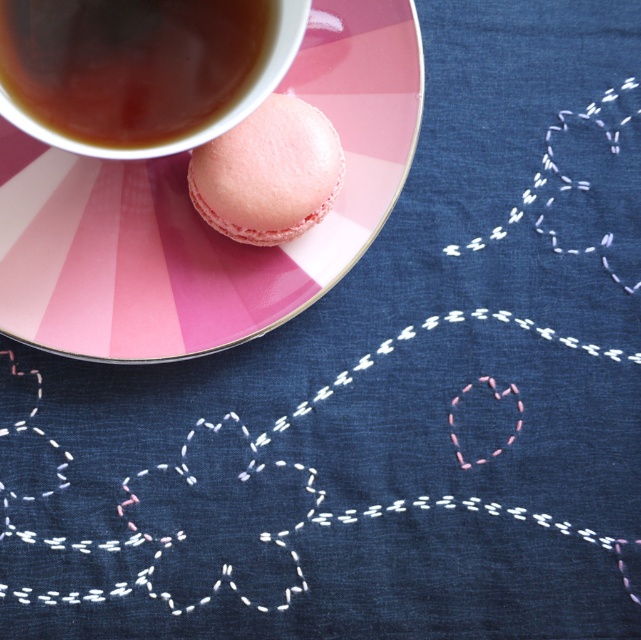
You are a food stylist arranging a tea set. You have a dark brown liquid at upper left and a pink matte macaron at center. Which item has a greater height?

The pink matte macaron at center is taller than the dark brown liquid at upper left because the dark brown liquid at upper left is shorter than pink matte macaron at center.

You are a food stylist arranging items on a table. You have a pink glossy macaron at upper left and a pink matte macaron at center. The customer wants to know if the distance between them is sufficient for a photo shoot. The minimum required distance for the camera setup is 3.5 inches. Can the current arrangement meet this requirement?

The pink glossy macaron at upper left is 3.64 inches away from the pink matte macaron at center. Since 3.64 inches is greater than the required 3.5 inches, the current arrangement meets the customer requirement.

You are a tea lover who wants to grab both the pink glossy macaron at upper left and the dark brown liquid at upper left. Given that your hand can reach 6 inches, can you reach both items without moving your hand?

The pink glossy macaron at upper left is 5.92 inches away from the dark brown liquid at upper left. Since your hand can reach 6 inches, you can reach both items without moving your hand.